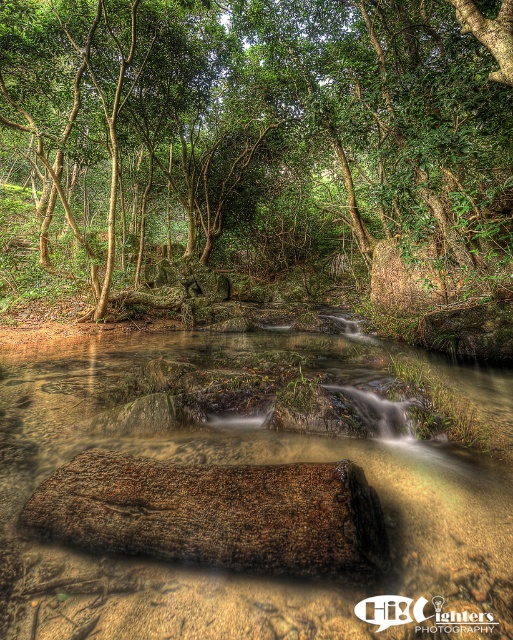
Question: Is clear sediment river at center bigger than brown rough wood at center?

Choices:
 (A) yes
 (B) no

Answer: (B)

Question: Which object is farther from the camera taking this photo?

Choices:
 (A) clear sediment river at center
 (B) green leafy tree at center
 (C) brown rough wood at center

Answer: (B)

Question: Is green leafy tree at center to the right of clear sediment river at center from the viewer's perspective?

Choices:
 (A) yes
 (B) no

Answer: (B)

Question: Which point is closer to the camera?

Choices:
 (A) green leafy tree at center
 (B) clear sediment river at center

Answer: (B)

Question: Is clear sediment river at center below brown rough wood at center?

Choices:
 (A) no
 (B) yes

Answer: (B)

Question: Estimate the real-world distances between objects in this image. Which object is closer to the green leafy tree at center?

Choices:
 (A) brown rough wood at center
 (B) clear sediment river at center

Answer: (A)